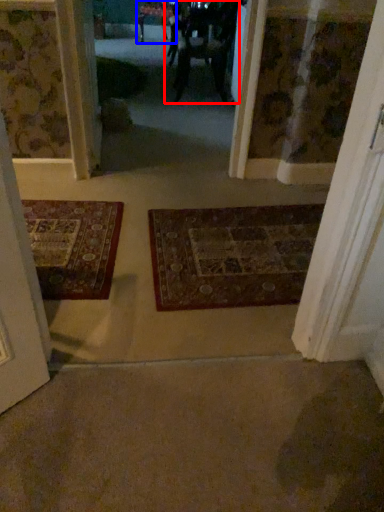
Question: Which point is closer to the camera, couple (highlighted by a red box) or furniture (highlighted by a blue box)?

Choices:
 (A) couple
 (B) furniture

Answer: (A)